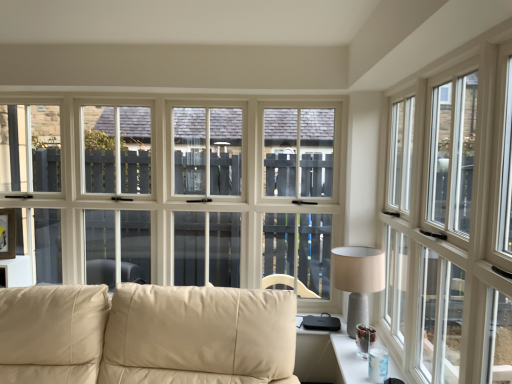
Question: Is white glossy window at right surrounded by beige leather couch at lower left?

Choices:
 (A) no
 (B) yes

Answer: (A)

Question: Is beige leather couch at lower left shorter than white glossy window at right?

Choices:
 (A) yes
 (B) no

Answer: (A)

Question: Is beige leather couch at lower left in contact with white glossy window at right?

Choices:
 (A) no
 (B) yes

Answer: (A)

Question: Is beige leather couch at lower left oriented towards white glossy window at right?

Choices:
 (A) no
 (B) yes

Answer: (A)

Question: From a real-world perspective, is beige leather couch at lower left under white glossy window at right?

Choices:
 (A) no
 (B) yes

Answer: (B)

Question: Based on their sizes in the image, would you say white glossy window at right is bigger or smaller than beige leather couch at lower left?

Choices:
 (A) small
 (B) big

Answer: (A)

Question: Considering the positions of white glossy window at right and beige leather couch at lower left in the image, is white glossy window at right taller or shorter than beige leather couch at lower left?

Choices:
 (A) short
 (B) tall

Answer: (B)

Question: Do you think white glossy window at right is within beige leather couch at lower left, or outside of it?

Choices:
 (A) inside
 (B) outside

Answer: (B)

Question: Is white glossy window at right to the left or to the right of beige leather couch at lower left in the image?

Choices:
 (A) right
 (B) left

Answer: (A)

Question: From the image's perspective, is white glossy window at right positioned above or below clear glass table at lower right?

Choices:
 (A) below
 (B) above

Answer: (B)

Question: Is white glossy window at right inside the boundaries of clear glass table at lower right, or outside?

Choices:
 (A) outside
 (B) inside

Answer: (A)

Question: Based on their positions, is white glossy window at right located to the left or right of clear glass table at lower right?

Choices:
 (A) right
 (B) left

Answer: (A)

Question: Considering their positions, is white glossy window at right located in front of or behind clear glass table at lower right?

Choices:
 (A) front
 (B) behind

Answer: (A)

Question: From a real-world perspective, is clear glass table at lower right above or below beige leather couch at lower left?

Choices:
 (A) below
 (B) above

Answer: (A)

Question: Would you say clear glass table at lower right is to the left or to the right of beige leather couch at lower left in the picture?

Choices:
 (A) right
 (B) left

Answer: (A)